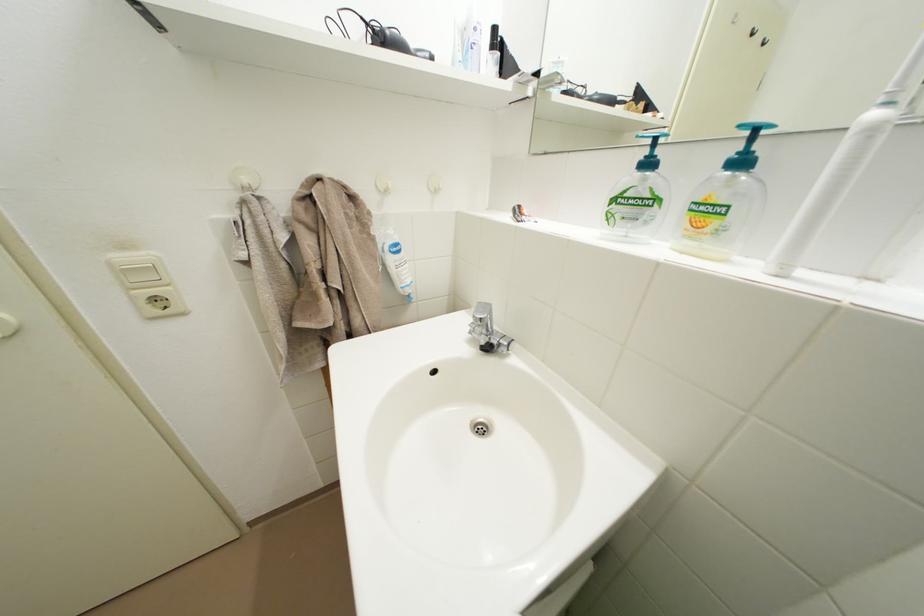
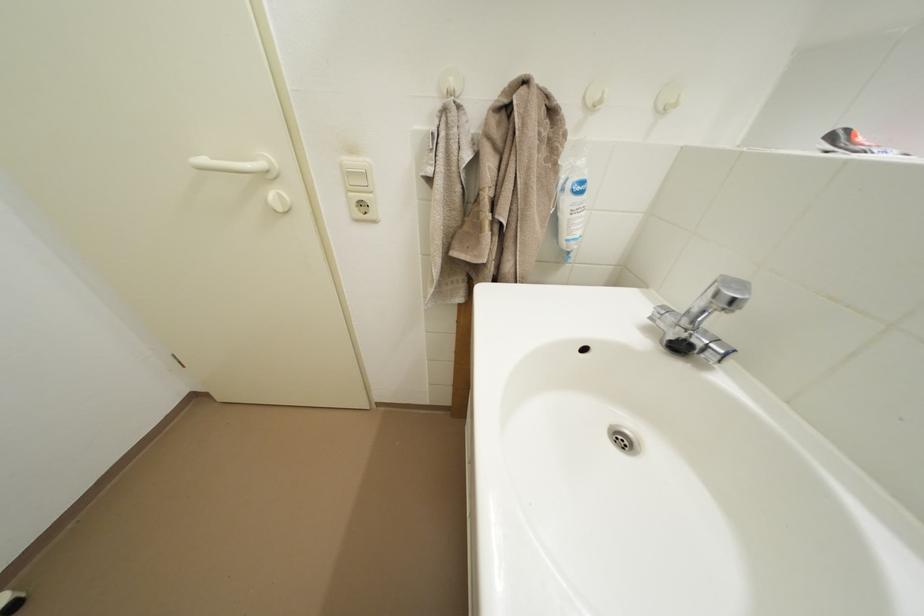
Question: Based on the continuous images, in which direction is the camera rotating? Reply with the corresponding letter.

Choices:
 (A) Left
 (B) Right
 (C) Up
 (D) Down

Answer: (A)